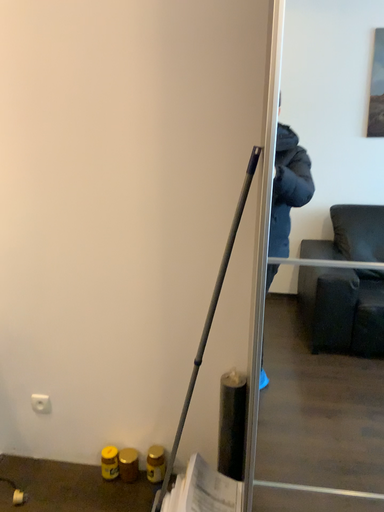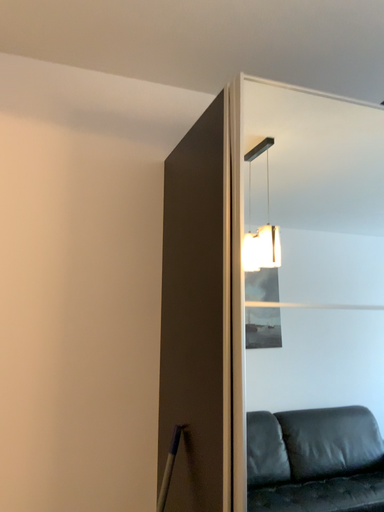
Question: How did the camera likely rotate when shooting the video?

Choices:
 (A) rotated downward
 (B) rotated upward

Answer: (B)